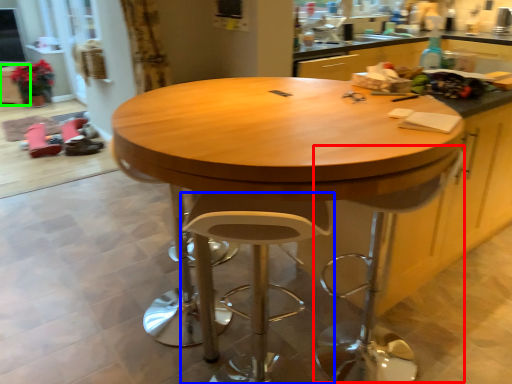
Question: Which is nearer to the swivel chair (highlighted by a red box)? stool (highlighted by a blue box) or cabinetry (highlighted by a green box).

Choices:
 (A) stool
 (B) cabinetry

Answer: (A)